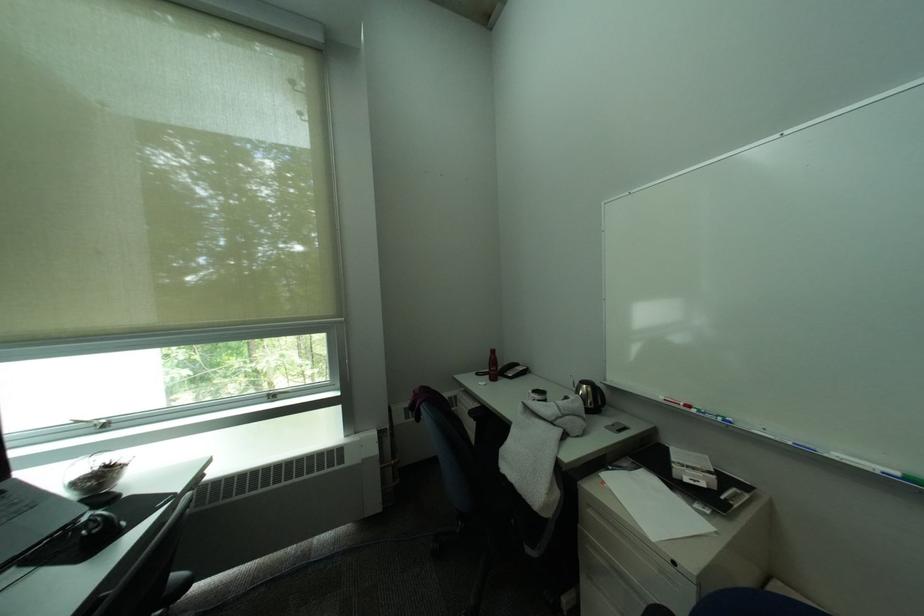
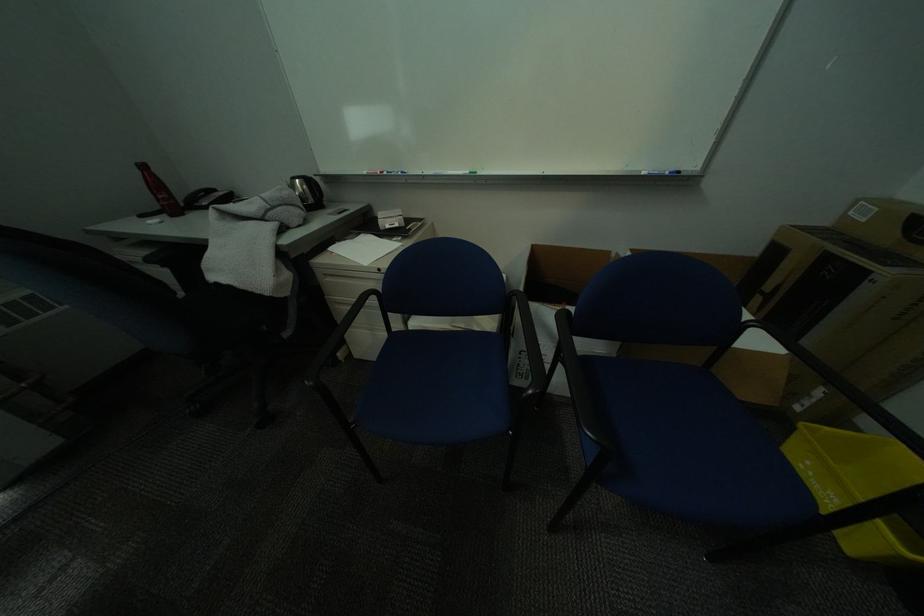
First-person continuous shooting, in which direction is the camera rotating?

The rotation direction of the camera is right-down.